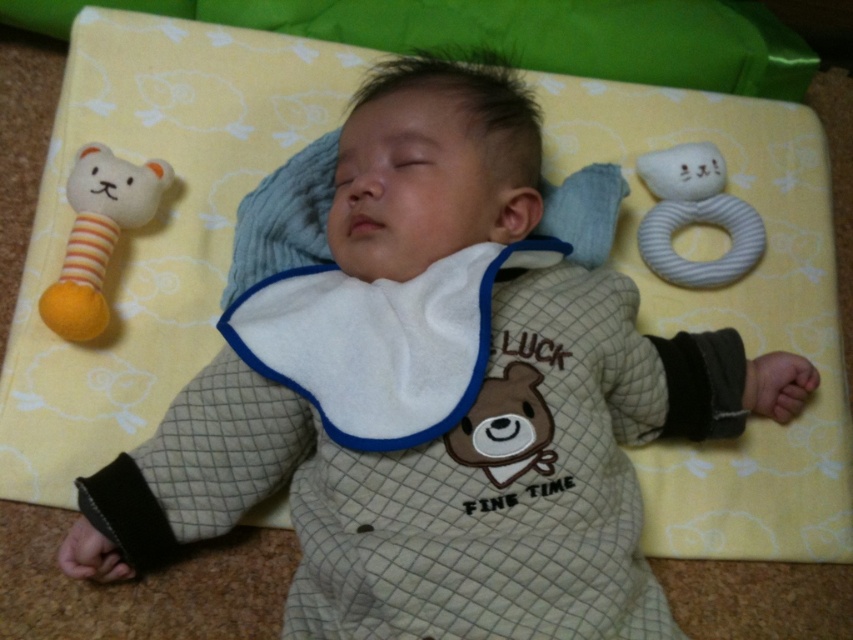
Question: Can you confirm if yellow striped plush toy at left is positioned to the right of white fabric ring at upper right?

Choices:
 (A) no
 (B) yes

Answer: (A)

Question: Which point is closer to the camera?

Choices:
 (A) (506, 426)
 (B) (106, 237)

Answer: (A)

Question: Can you confirm if white fabric ring at upper right is positioned to the left of brown plush bear at center?

Choices:
 (A) yes
 (B) no

Answer: (B)

Question: Which point is farther to the camera?

Choices:
 (A) (654, 228)
 (B) (103, 317)
 (C) (498, 486)

Answer: (A)

Question: Does white fabric ring at upper right appear on the right side of brown plush bear at center?

Choices:
 (A) yes
 (B) no

Answer: (A)

Question: Considering the real-world distances, which object is farthest from the brown plush bear at center?

Choices:
 (A) yellow striped plush toy at left
 (B) white fabric ring at upper right

Answer: (A)